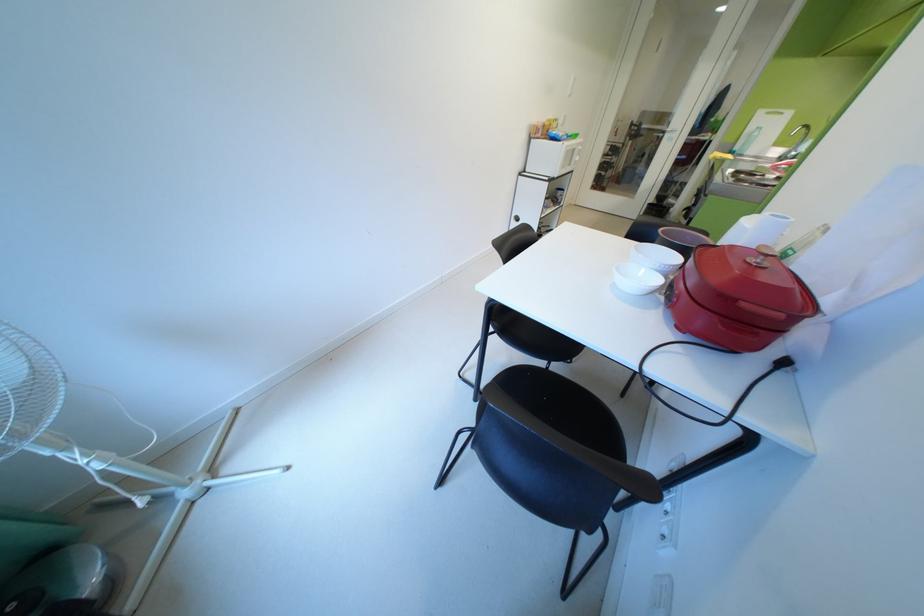
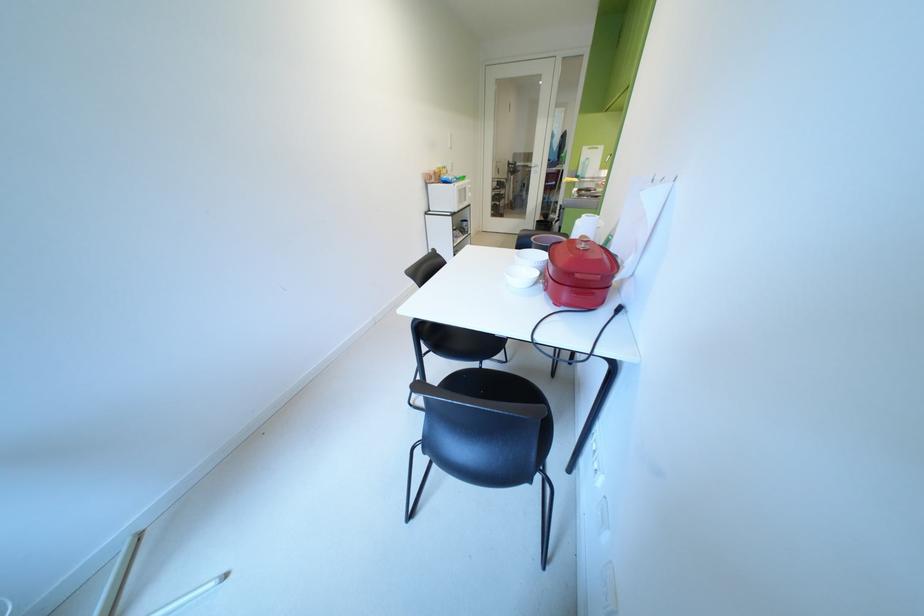
Question: The first image is from the beginning of the video and the second image is from the end. How did the camera likely rotate when shooting the video?

Choices:
 (A) Left
 (B) Right
 (C) Up
 (D) Down

Answer: (B)